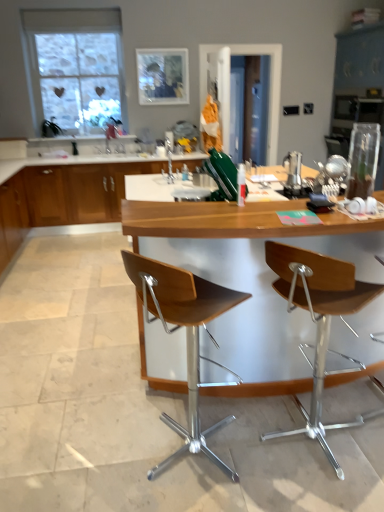
Image resolution: width=384 pixels, height=512 pixels. In order to click on free region on the left part of woodenmaterial/texturetable at center in this screenshot , I will do `click(73, 323)`.